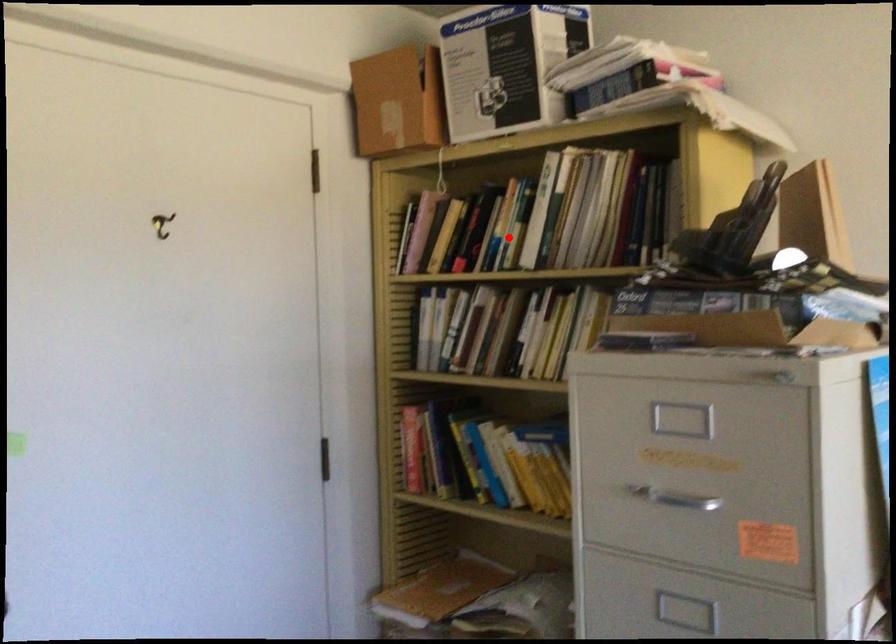
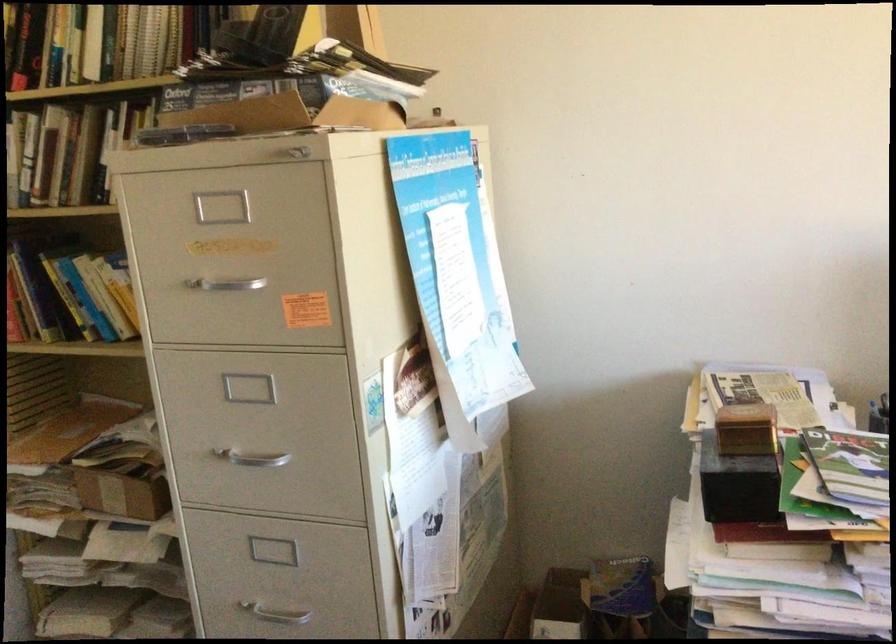
Locate, in the second image, the point that corresponds to the highlighted location in the first image.

(62, 46)